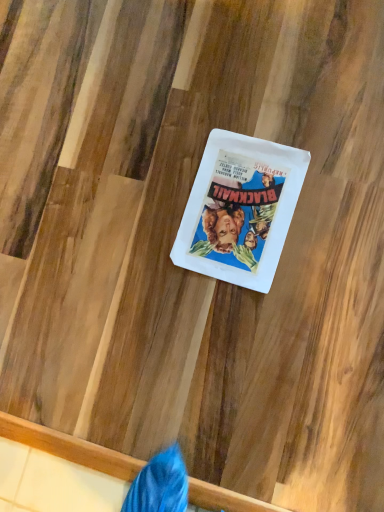
The width and height of the screenshot is (384, 512). Find the location of `free area behind white paper at center`. free area behind white paper at center is located at coordinates (165, 131).